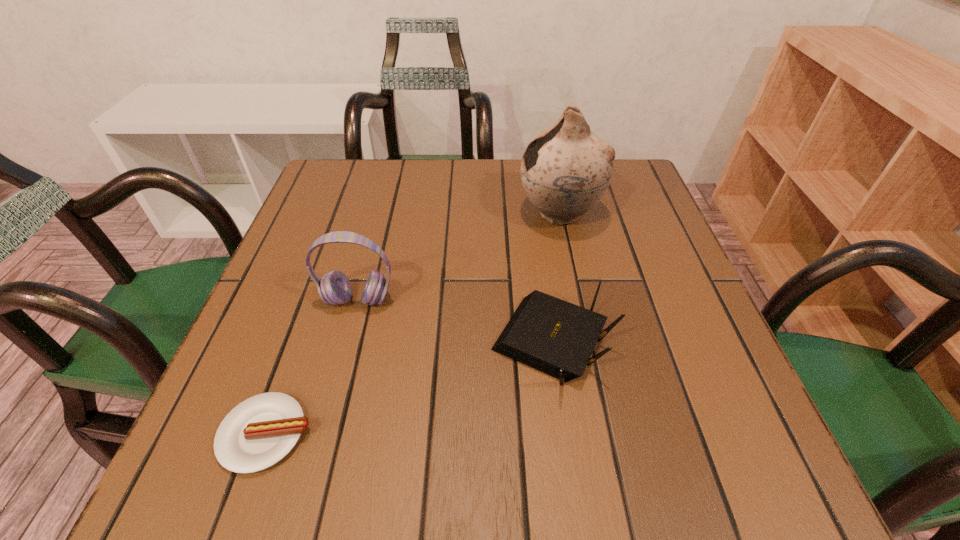
You are a GUI agent. You are given a task and a screenshot of the screen. Output one action in this format:
    pyautogui.click(x=<x>, y=<y>)
    Task: Click on the free space between the tallest object and the sausage
    This screenshot has width=960, height=540.
    Given the screenshot: What is the action you would take?
    pyautogui.click(x=413, y=323)

Locate an element on the screen. The height and width of the screenshot is (540, 960). free spot between the farthest object and the sausage is located at coordinates (413, 323).

You are a GUI agent. You are given a task and a screenshot of the screen. Output one action in this format:
    pyautogui.click(x=<x>, y=<y>)
    Task: Click on the free space between the headset and the sausage
    This screenshot has width=960, height=540.
    Given the screenshot: What is the action you would take?
    pyautogui.click(x=312, y=367)

This screenshot has width=960, height=540. I want to click on object that stands as the second closest to the shortest object, so click(x=551, y=335).

Locate an element on the screen. This screenshot has width=960, height=540. object that is the nearest to the second shortest object is located at coordinates 565,170.

The width and height of the screenshot is (960, 540). What are the coordinates of `free space that satisfies the following two spatial constraints: 1. on the headband and ear cups of the third tallest object; 2. on the left side of the headset` in the screenshot? It's located at (347, 344).

Identify the location of free region that satisfies the following two spatial constraints: 1. from the spout of the pottery; 2. on the front side of the second shortest object. (587, 344).

Where is `free location that satisfies the following two spatial constraints: 1. from the spout of the farthest object; 2. on the headband and ear cups of the headset`? This screenshot has height=540, width=960. free location that satisfies the following two spatial constraints: 1. from the spout of the farthest object; 2. on the headband and ear cups of the headset is located at coordinates (577, 300).